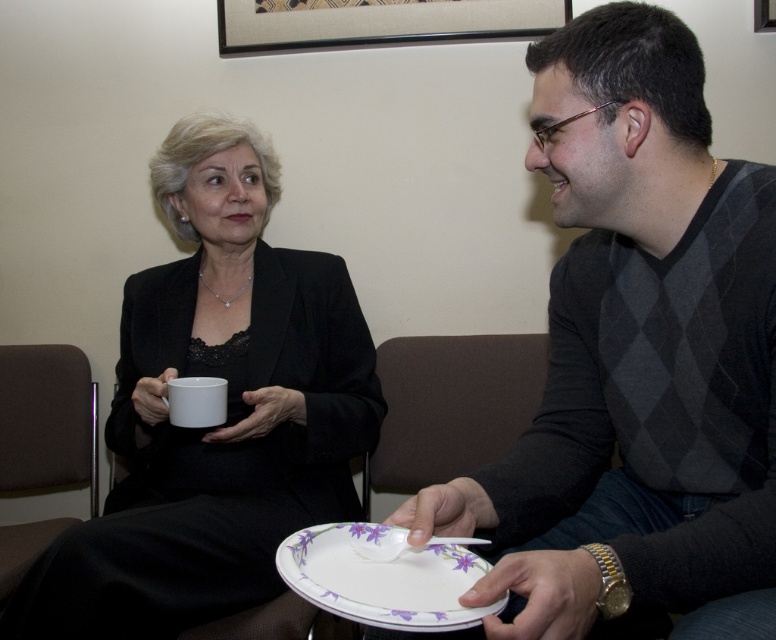
Which is more to the right, matte gray sweater at center or white porcelain plate at lower center?

matte gray sweater at center is more to the right.

Between matte gray sweater at center and white porcelain plate at lower center, which one is positioned higher?

Positioned higher is matte gray sweater at center.

Which is in front, point (674, 84) or point (340, 600)?

Point (340, 600) is more forward.

In order to click on matte gray sweater at center in this screenshot , I will do `click(636, 355)`.

Who is higher up, matte black suit at center or white matte mug at center?

matte black suit at center

Is point (215, 116) closer to viewer compared to point (210, 385)?

No, (215, 116) is further to viewer.

Is point (335, 278) positioned after point (192, 422)?

Yes.

Image resolution: width=776 pixels, height=640 pixels. I want to click on matte black suit at center, so click(227, 410).

Can you confirm if matte gray sweater at center is positioned to the right of white matte mug at center?

Yes, matte gray sweater at center is to the right of white matte mug at center.

Which is behind, point (629, 205) or point (215, 410)?

Point (215, 410)

Locate an element on the screen. matte gray sweater at center is located at coordinates click(636, 355).